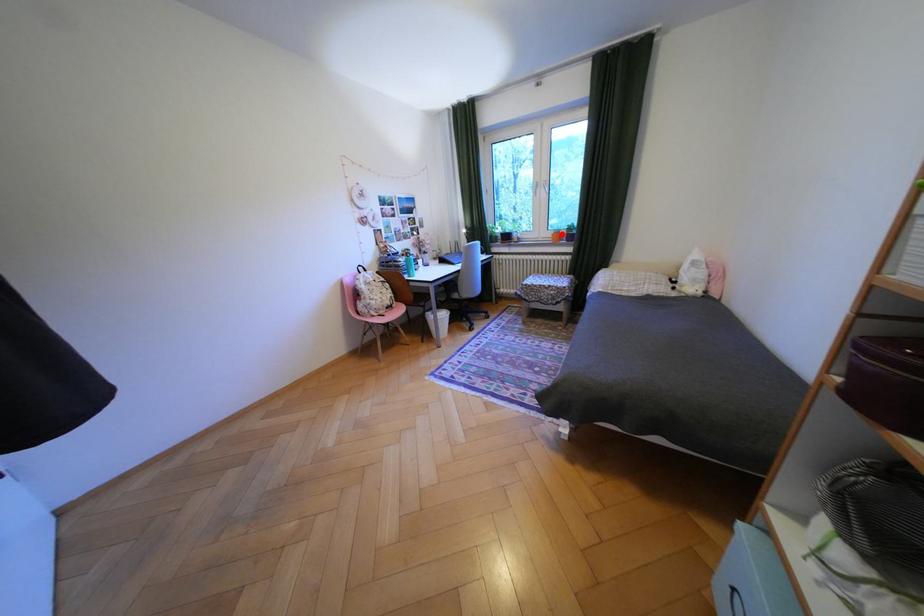
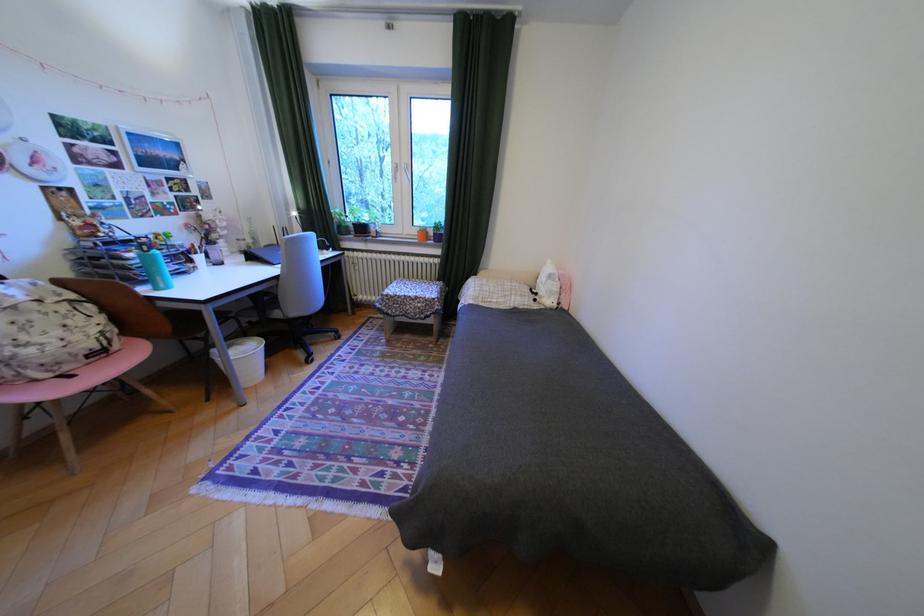
The point at the highlighted location is marked in the first image. Where is the corresponding point in the second image?

(427, 232)